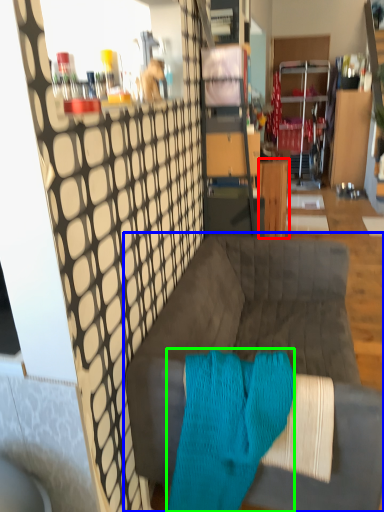
Question: Which object is the closest to the table (highlighted by a red box)? Choose among these: studio couch (highlighted by a blue box) or aqua (highlighted by a green box).

Choices:
 (A) studio couch
 (B) aqua

Answer: (A)